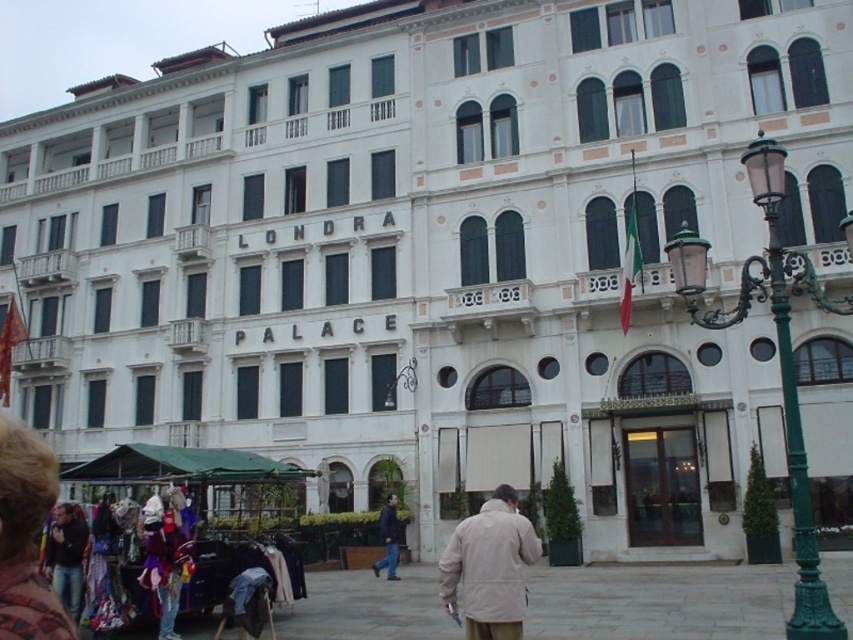
Question: Where is beige fabric coat at center located in relation to dark blue jeans at lower left in the image?

Choices:
 (A) below
 (B) above

Answer: (A)

Question: Which object is closer to the camera taking this photo?

Choices:
 (A) dark blue jeans at lower left
 (B) dark blue jacket at center

Answer: (A)

Question: Which object is closer to the camera taking this photo?

Choices:
 (A) green wrought iron lamp post at center right
 (B) dark blue jacket at center
 (C) beige fabric coat at center

Answer: (A)

Question: Which object is the closest to the dark blue jacket at center?

Choices:
 (A) dark blue jeans at lower left
 (B) beige fabric coat at center

Answer: (A)

Question: Can you confirm if beige fabric coat at center is positioned above dark blue jacket at center?

Choices:
 (A) yes
 (B) no

Answer: (A)

Question: Can you confirm if beige fabric coat at center is wider than dark blue jeans at lower left?

Choices:
 (A) no
 (B) yes

Answer: (B)